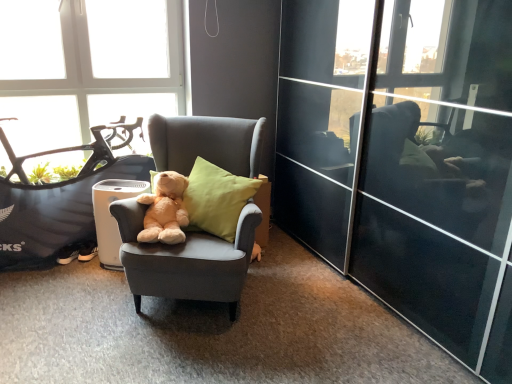
Question: Should I look upward or downward to see matte gray armchair at center?

Choices:
 (A) up
 (B) down

Answer: (B)

Question: Does soft yellow cushion at center turn towards transparent glass window at upper left?

Choices:
 (A) no
 (B) yes

Answer: (A)

Question: Is soft yellow cushion at center next to transparent glass window at upper left and touching it?

Choices:
 (A) no
 (B) yes

Answer: (A)

Question: Can you confirm if soft yellow cushion at center is taller than transparent glass window at upper left?

Choices:
 (A) yes
 (B) no

Answer: (B)

Question: Is soft yellow cushion at center behind transparent glass window at upper left?

Choices:
 (A) yes
 (B) no

Answer: (B)

Question: Is soft yellow cushion at center looking in the opposite direction of transparent glass window at upper left?

Choices:
 (A) yes
 (B) no

Answer: (B)

Question: From the image's perspective, is soft yellow cushion at center over transparent glass window at upper left?

Choices:
 (A) yes
 (B) no

Answer: (B)

Question: Considering the relative positions of black matte mountain bike at left and soft yellow cushion at center in the image provided, is black matte mountain bike at left to the left of soft yellow cushion at center from the viewer's perspective?

Choices:
 (A) yes
 (B) no

Answer: (A)

Question: Is black matte mountain bike at left shorter than soft yellow cushion at center?

Choices:
 (A) no
 (B) yes

Answer: (A)

Question: From a real-world perspective, is black matte mountain bike at left physically above soft yellow cushion at center?

Choices:
 (A) no
 (B) yes

Answer: (A)

Question: Is soft yellow cushion at center located within black matte mountain bike at left?

Choices:
 (A) no
 (B) yes

Answer: (A)

Question: Is black matte mountain bike at left bigger than soft yellow cushion at center?

Choices:
 (A) yes
 (B) no

Answer: (A)

Question: Can you confirm if black matte mountain bike at left is wider than soft yellow cushion at center?

Choices:
 (A) yes
 (B) no

Answer: (B)

Question: Can soft plush teddy bear at center be found inside matte gray armchair at center?

Choices:
 (A) yes
 (B) no

Answer: (A)